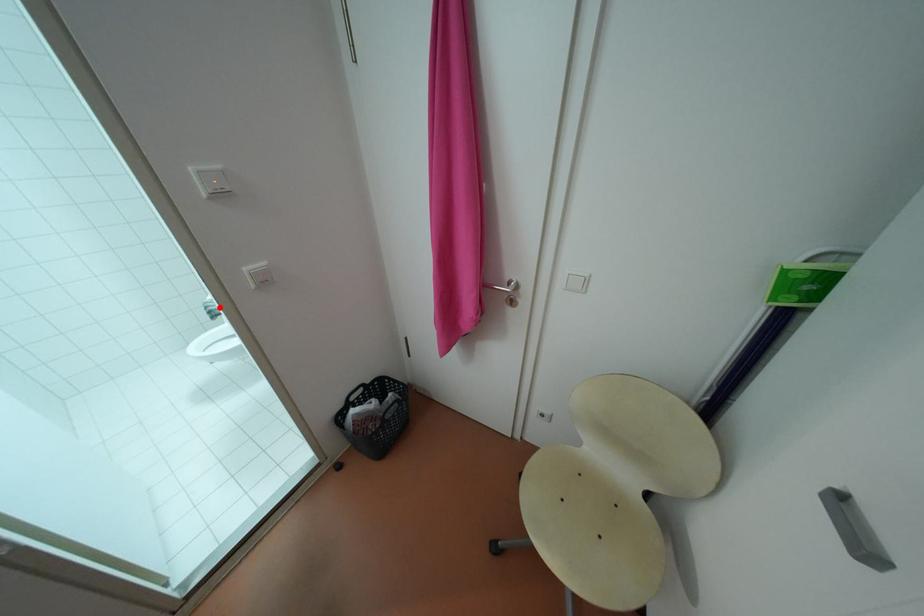
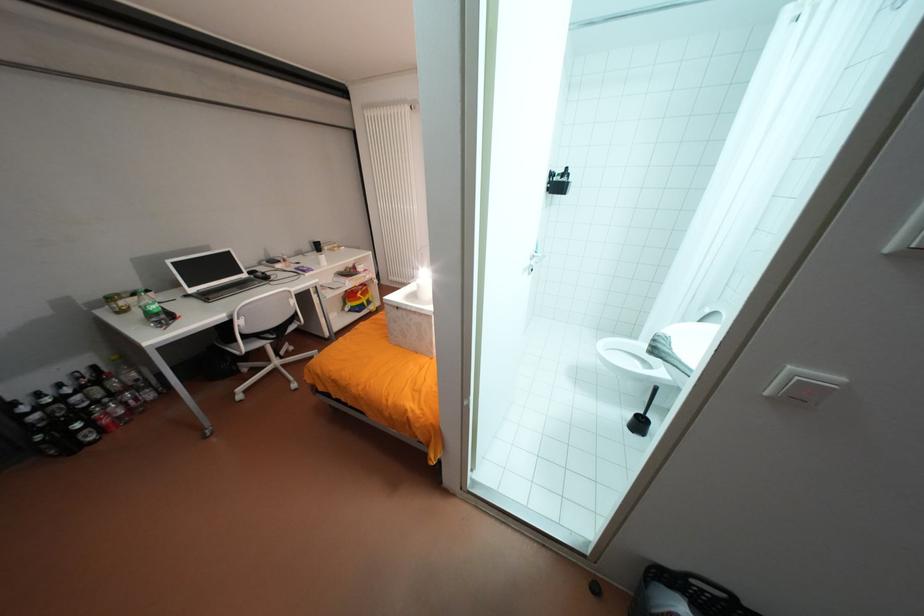
In the second image, find the point that corresponds to the highlighted location in the first image.

(669, 345)